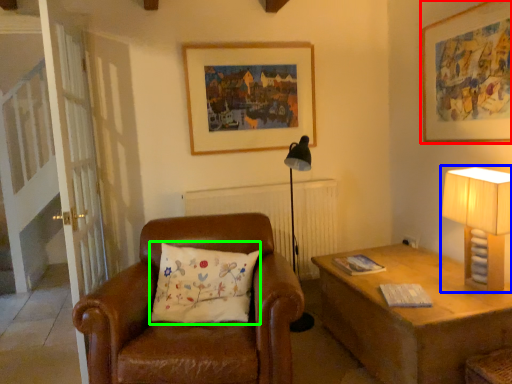
Question: Considering the real-world distances, which object is farthest from picture frame (highlighted by a red box)? table lamp (highlighted by a blue box) or pillow (highlighted by a green box)?

Choices:
 (A) table lamp
 (B) pillow

Answer: (B)